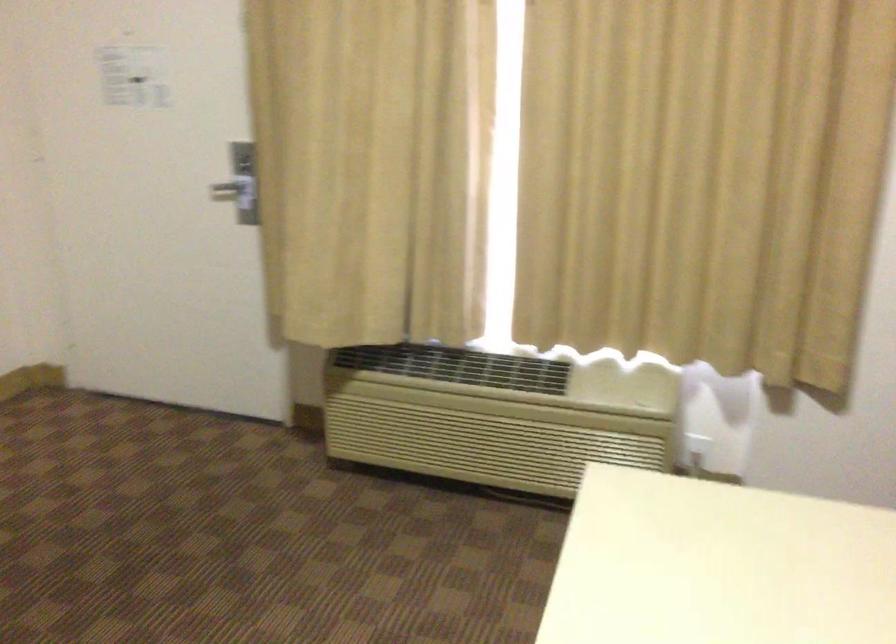
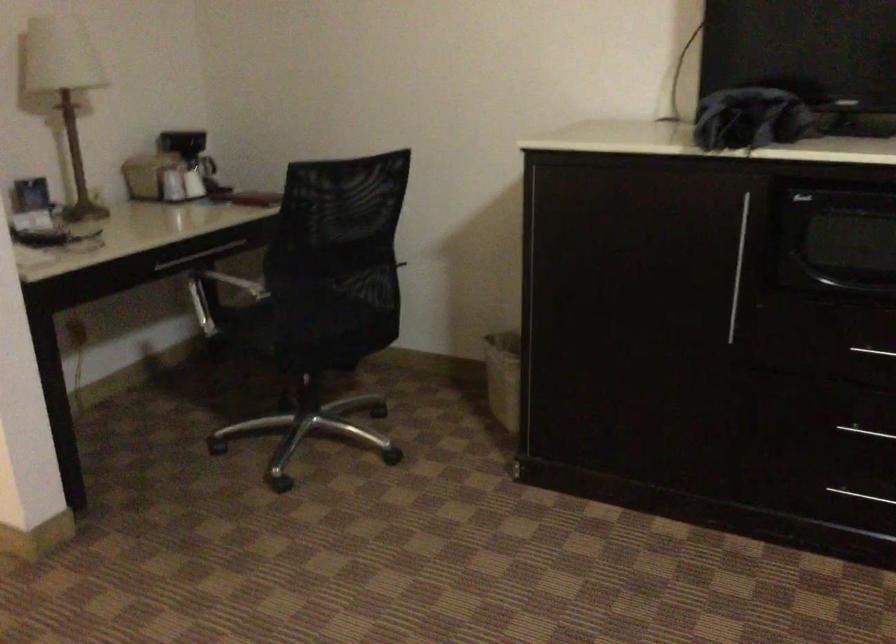
First-person continuous shooting, in which direction is the camera rotating?

The camera's rotation is toward left-down.